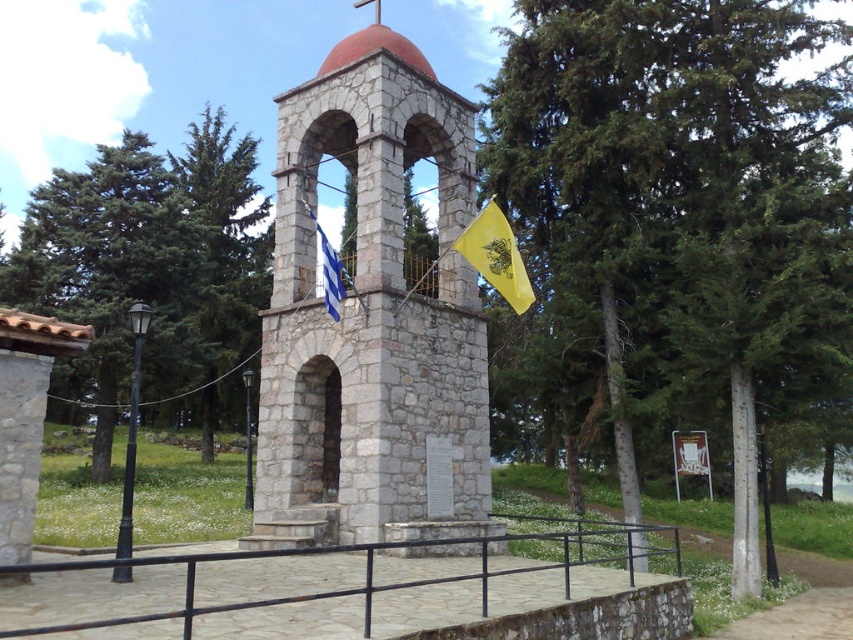
Question: Which object is closer to the camera taking this photo?

Choices:
 (A) green leafy tree at center
 (B) stone bell tower at center

Answer: (B)

Question: Which object is farther from the camera taking this photo?

Choices:
 (A) black metal/rail at center
 (B) yellow fabric flag at center
 (C) green coniferous tree at left

Answer: (C)

Question: Is the position of black metal/rail at center less distant than that of yellow fabric flag at center?

Choices:
 (A) yes
 (B) no

Answer: (A)

Question: Which of the following is the farthest from the observer?

Choices:
 (A) yellow fabric flag at center
 (B) blue and white striped fabric at center
 (C) stone bell tower at center

Answer: (A)

Question: Observing the image, what is the correct spatial positioning of stone bell tower at center in reference to blue and white striped fabric at center?

Choices:
 (A) above
 (B) below

Answer: (A)

Question: In this image, where is green coniferous tree at left located relative to blue and white striped fabric at center?

Choices:
 (A) right
 (B) left

Answer: (B)